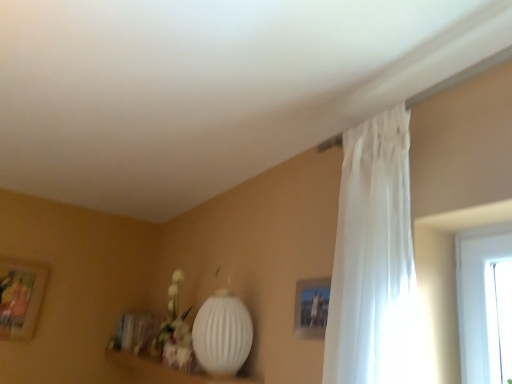
Question: Should I look upward or downward to see white ribbed lamp at lower center?

Choices:
 (A) down
 (B) up

Answer: (A)

Question: Does white sheer curtain at upper right have a smaller size compared to wooden picture frame at left?

Choices:
 (A) no
 (B) yes

Answer: (A)

Question: Is white sheer curtain at upper right shorter than wooden picture frame at left?

Choices:
 (A) yes
 (B) no

Answer: (B)

Question: From the image's perspective, would you say white sheer curtain at upper right is positioned over wooden picture frame at left?

Choices:
 (A) no
 (B) yes

Answer: (B)

Question: From a real-world perspective, is white sheer curtain at upper right physically below wooden picture frame at left?

Choices:
 (A) no
 (B) yes

Answer: (A)

Question: Are white sheer curtain at upper right and wooden picture frame at left located far from each other?

Choices:
 (A) yes
 (B) no

Answer: (A)

Question: Is white sheer curtain at upper right further to camera compared to wooden picture frame at left?

Choices:
 (A) no
 (B) yes

Answer: (A)

Question: Considering the relative positions of white ribbed lamp at lower center and wooden picture frame at left in the image provided, is white ribbed lamp at lower center to the left of wooden picture frame at left from the viewer's perspective?

Choices:
 (A) no
 (B) yes

Answer: (A)

Question: From the image's perspective, does white ribbed lamp at lower center appear higher than wooden picture frame at left?

Choices:
 (A) yes
 (B) no

Answer: (A)

Question: Can you see white ribbed lamp at lower center touching wooden picture frame at left?

Choices:
 (A) no
 (B) yes

Answer: (A)

Question: Is white ribbed lamp at lower center positioned with its back to wooden picture frame at left?

Choices:
 (A) yes
 (B) no

Answer: (B)

Question: Can you confirm if white ribbed lamp at lower center is taller than wooden picture frame at left?

Choices:
 (A) yes
 (B) no

Answer: (B)

Question: From a real-world perspective, is white ribbed lamp at lower center located higher than wooden picture frame at left?

Choices:
 (A) yes
 (B) no

Answer: (B)

Question: Is white ribbed lamp at lower center not near white matte vase at lower center?

Choices:
 (A) no
 (B) yes

Answer: (A)